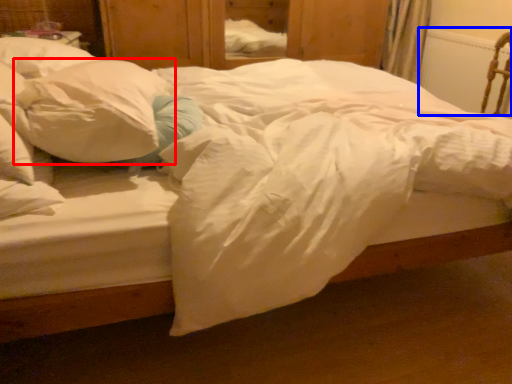
Question: Among these objects, which one is farthest to the camera, pillow (highlighted by a red box) or radiator (highlighted by a blue box)?

Choices:
 (A) pillow
 (B) radiator

Answer: (B)